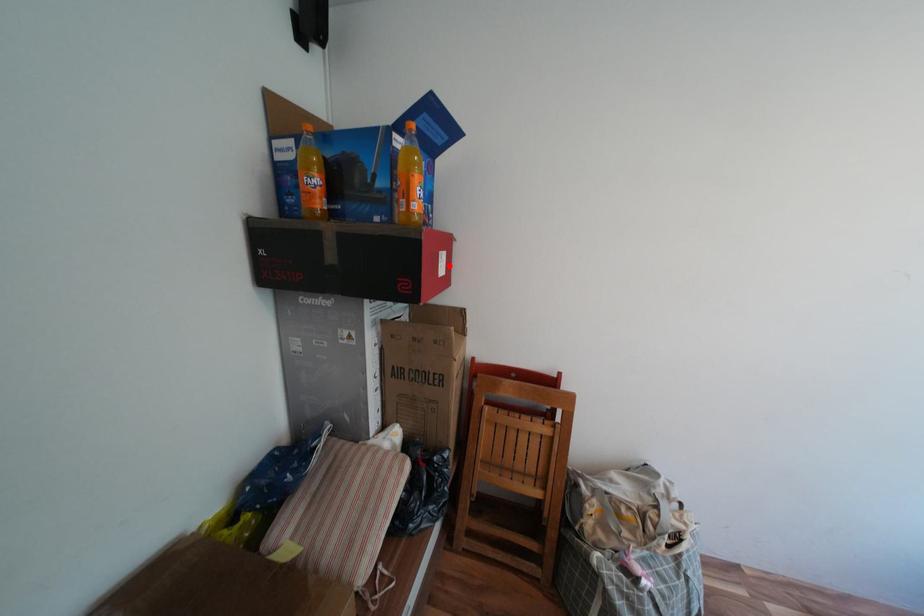
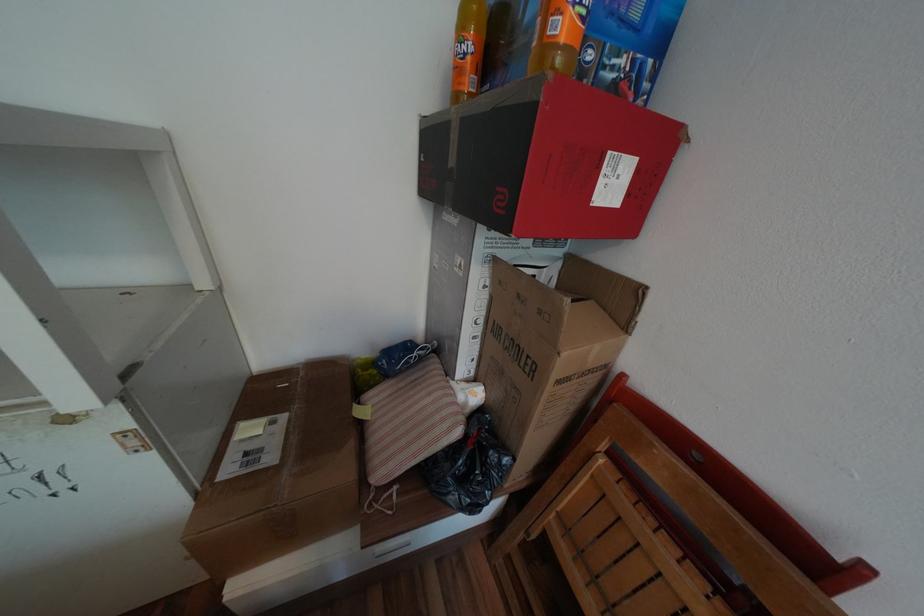
In the second image, find the point that corresponds to the highlighted location in the first image.

(611, 182)